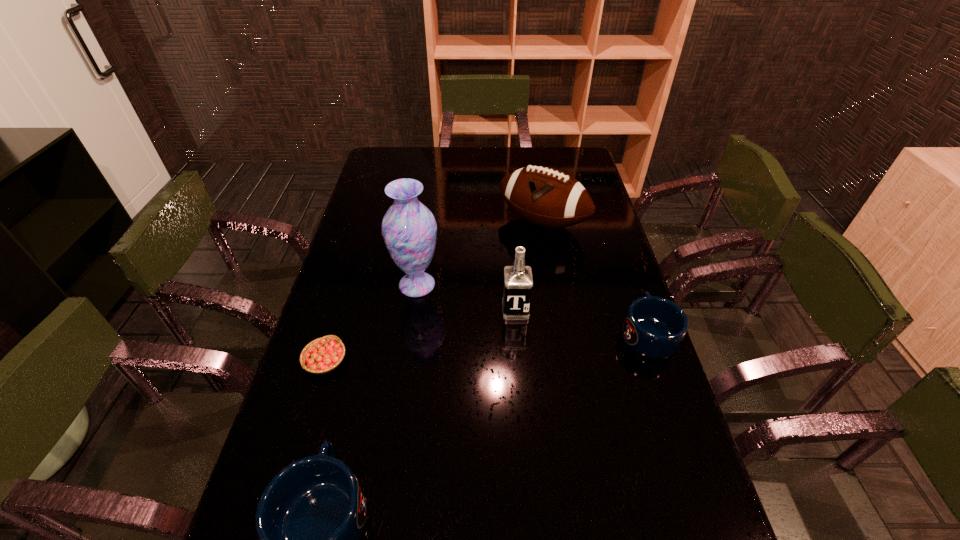
I want to click on the farther mug, so click(654, 327).

Identify the location of the right mug. (654, 327).

What are the coordinates of `vase` in the screenshot? It's located at (409, 229).

This screenshot has width=960, height=540. I want to click on vodka, so click(x=518, y=282).

The image size is (960, 540). Identify the location of the farthest object. (546, 197).

This screenshot has width=960, height=540. I want to click on strawberry, so click(x=323, y=355).

The height and width of the screenshot is (540, 960). I want to click on blank space located 0.300m with the handle on the side of the farther mug, so click(616, 243).

What are the coordinates of `vacant space located with the handle on the side of the farther mug` in the screenshot? It's located at (616, 241).

You are a GUI agent. You are given a task and a screenshot of the screen. Output one action in this format:
    pyautogui.click(x=<x>, y=<y>)
    Task: Click on the vacant region located with the handle on the side of the farther mug
    The height and width of the screenshot is (540, 960).
    Given the screenshot: What is the action you would take?
    click(612, 232)

Identify the location of free space located on the back of the tallest object. This screenshot has height=540, width=960. point(425,228).